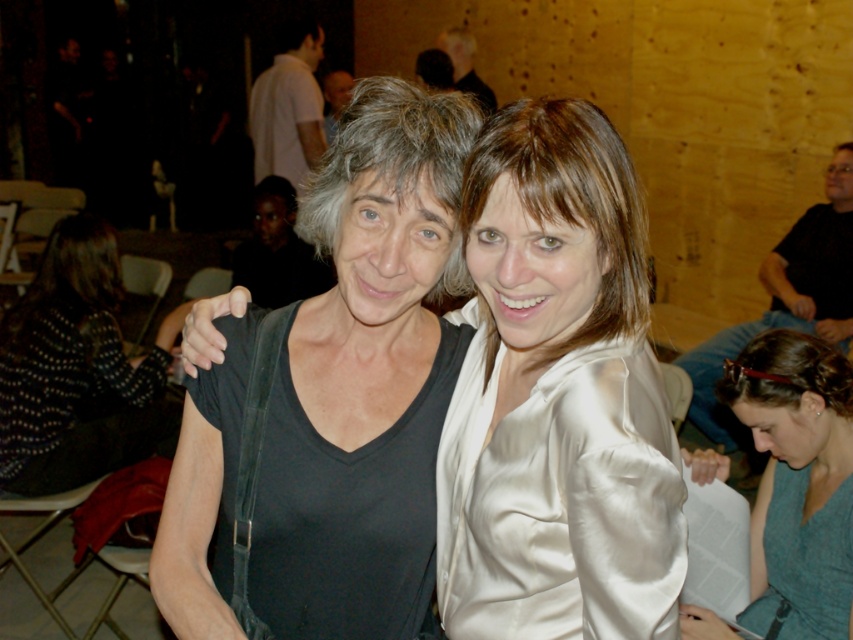
You are a photographer setting up for a group photo. You notice two outfits in the center of the image. The satin white blouse at center and the black matte dress at center. Which outfit is covering part of the other?

The satin white blouse at center is positioned over the black matte dress at center, so it is covering part of it.

You are at a social event and need to locate two people wearing specific outfits. The satin white blouse at center and the black matte dress at center are both in the image. Which one is positioned to the right?

The satin white blouse at center is to the right of the black matte dress at center, so the satin white blouse at center is positioned to the right.